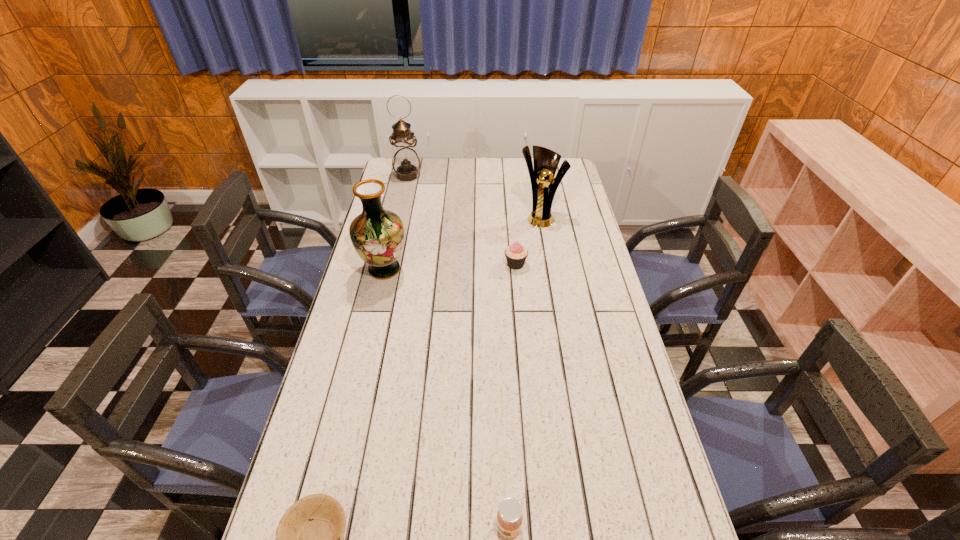
This screenshot has height=540, width=960. What are the coordinates of `free point that satisfies the following two spatial constraints: 1. on the back side of the oil lamp; 2. on the left side of the vase` in the screenshot? It's located at (406, 176).